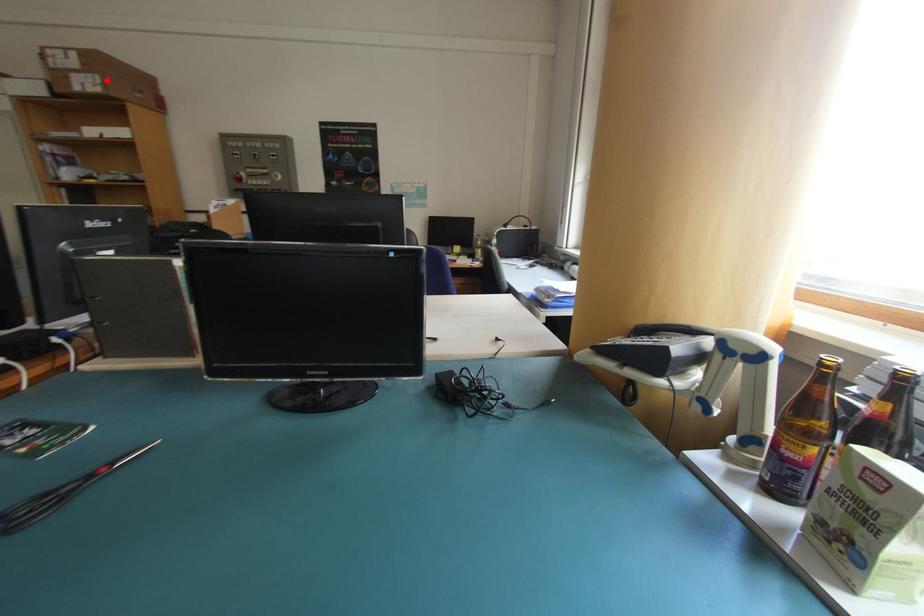
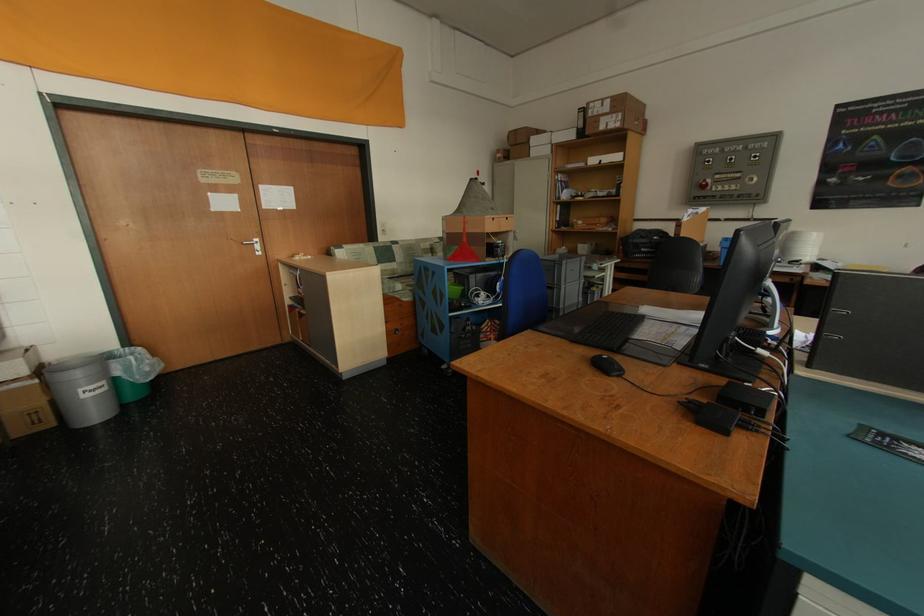
Question: I am providing you with two images of the same scene from different viewpoints. A red point is shown in image1. For the corresponding object point in image2, is it positioned nearer or farther from the camera?

Choices:
 (A) Nearer
 (B) Farther

Answer: (A)